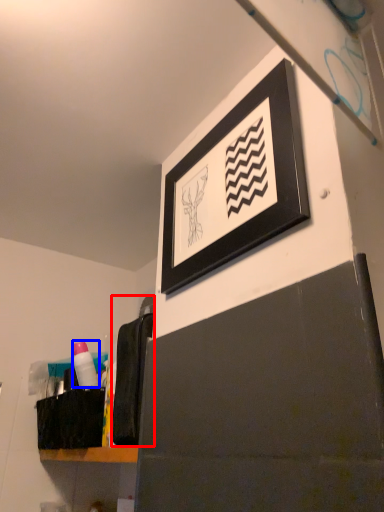
Question: Which object appears farthest to the camera in this image, laundry (highlighted by a red box) or toiletry (highlighted by a blue box)?

Choices:
 (A) laundry
 (B) toiletry

Answer: (B)